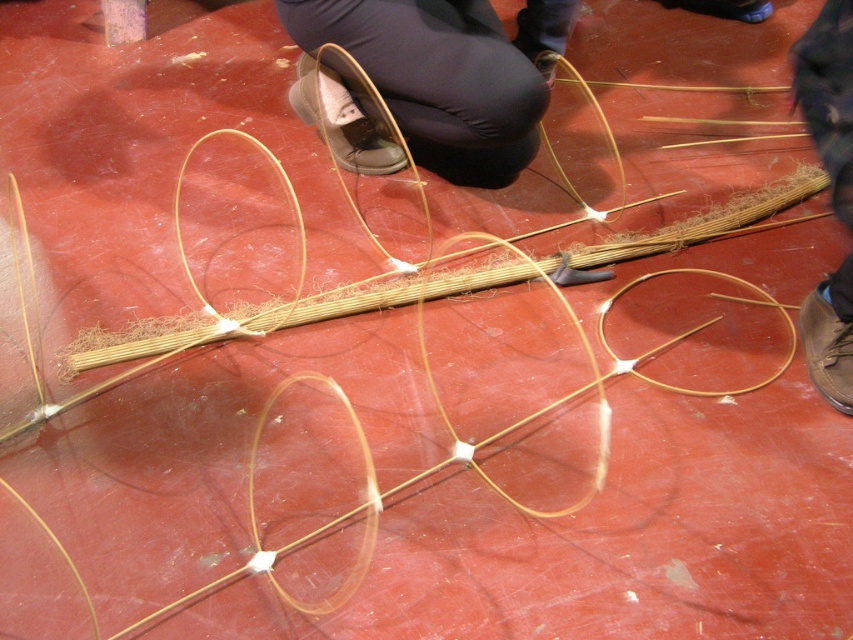
Question: Which point appears closest to the camera in this image?

Choices:
 (A) (361, 20)
 (B) (834, 349)

Answer: (B)

Question: Where is brown leather shoe at center located in relation to brown leather shoe at lower right in the image?

Choices:
 (A) below
 (B) above

Answer: (B)

Question: Among these objects, which one is nearest to the camera?

Choices:
 (A) brown leather shoe at center
 (B) brown leather shoe at lower right

Answer: (B)

Question: Is brown leather shoe at center further to the viewer compared to brown leather shoe at lower right?

Choices:
 (A) yes
 (B) no

Answer: (A)

Question: Can you confirm if brown leather shoe at center is thinner than brown leather shoe at lower right?

Choices:
 (A) no
 (B) yes

Answer: (A)